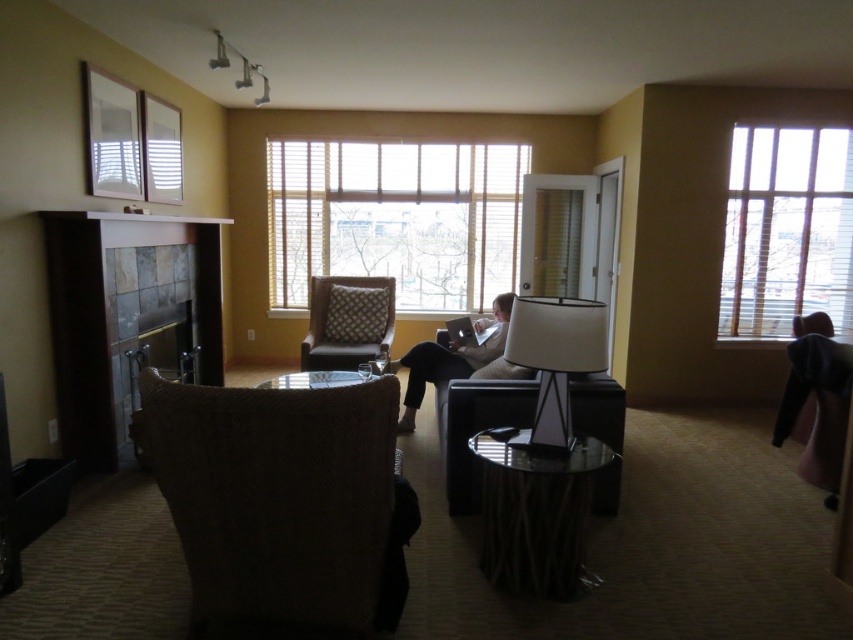
You are standing in the living room and want to adjust the wooden blinds at center. To do so, you need to walk towards their exact 2D location. What are the coordinates you should aim for?

The wooden blinds at center are located at coordinates point (395, 218), so you should aim for point (395, 218) to adjust them.